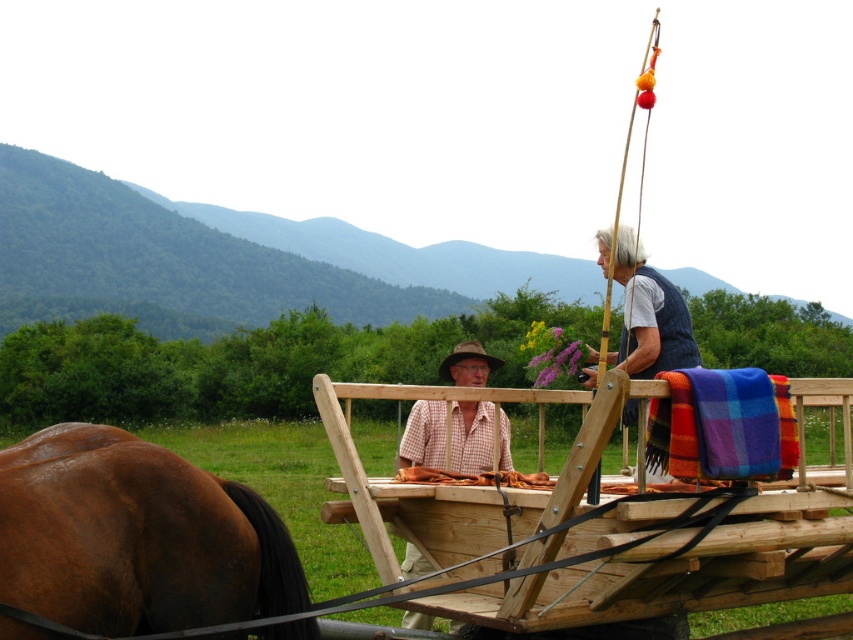
You are a photographer standing in the middle of the scene. You want to capture both the brown glossy horse at left and the plaid woolen blanket at upper right in a single shot. Which direction should you move to ensure both objects are visible in your camera frame?

You should move to the right because the brown glossy horse at left is to the left of the plaid woolen blanket at upper right. By moving right, you can position yourself to include both objects within the frame.

You are standing in the rural scene and want to place a small flag at the closest point between point (45, 506) and point (457, 460). Which point should you choose to place the flag so it is closer to you?

Point (45, 506) is closer to the viewer than point (457, 460), so you should place the flag at point (45, 506) to be closer to you.